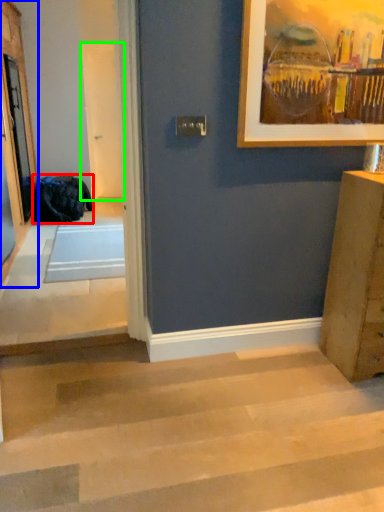
Question: Which object is the farthest from laundry (highlighted by a red box)? Choose among these: screen door (highlighted by a blue box) or screen door (highlighted by a green box).

Choices:
 (A) screen door
 (B) screen door

Answer: (B)